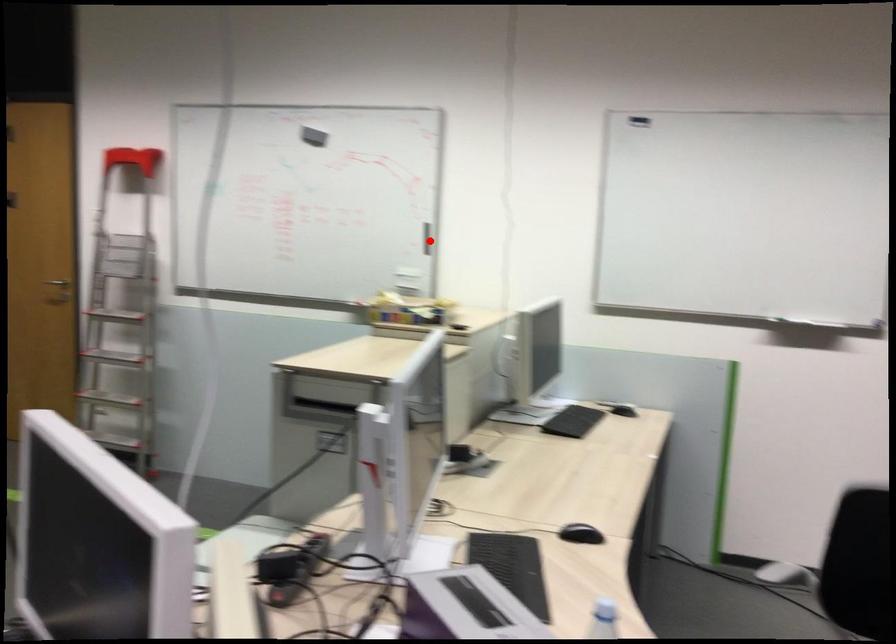
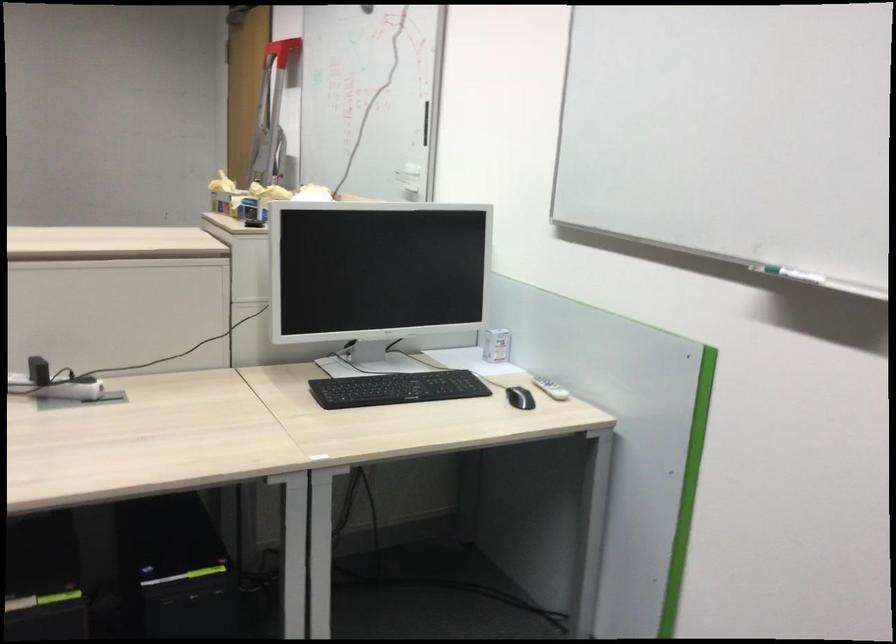
Question: A red point is marked in image1. In image2, is the corresponding 3D point closer to the camera or farther? Reply with the corresponding letter.

Choices:
 (A) The corresponding 3D point is closer.
 (B) The corresponding 3D point is farther.

Answer: (A)